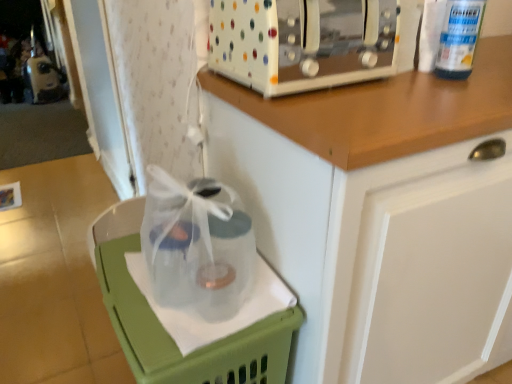
Question: Considering the relative sizes of green plastic basket at lower left and white polka dot toaster at upper center in the image provided, is green plastic basket at lower left shorter than white polka dot toaster at upper center?

Choices:
 (A) yes
 (B) no

Answer: (B)

Question: Is green plastic basket at lower left further to the viewer compared to white polka dot toaster at upper center?

Choices:
 (A) no
 (B) yes

Answer: (A)

Question: From the image's perspective, is green plastic basket at lower left over white polka dot toaster at upper center?

Choices:
 (A) yes
 (B) no

Answer: (B)

Question: Does green plastic basket at lower left have a greater height compared to white polka dot toaster at upper center?

Choices:
 (A) no
 (B) yes

Answer: (B)

Question: Can you confirm if green plastic basket at lower left is smaller than white polka dot toaster at upper center?

Choices:
 (A) no
 (B) yes

Answer: (A)

Question: Is green plastic basket at lower left looking in the opposite direction of white polka dot toaster at upper center?

Choices:
 (A) no
 (B) yes

Answer: (A)

Question: Does white polka dot toaster at upper center have a smaller size compared to white glossy cabinet at upper center?

Choices:
 (A) yes
 (B) no

Answer: (A)

Question: Would you say white polka dot toaster at upper center is outside white glossy cabinet at upper center?

Choices:
 (A) yes
 (B) no

Answer: (A)

Question: Does white polka dot toaster at upper center have a greater height compared to white glossy cabinet at upper center?

Choices:
 (A) no
 (B) yes

Answer: (A)

Question: Is white polka dot toaster at upper center oriented towards white glossy cabinet at upper center?

Choices:
 (A) yes
 (B) no

Answer: (B)

Question: From the image's perspective, is white polka dot toaster at upper center located above white glossy cabinet at upper center?

Choices:
 (A) no
 (B) yes

Answer: (B)

Question: Is white polka dot toaster at upper center at the right side of white glossy cabinet at upper center?

Choices:
 (A) no
 (B) yes

Answer: (A)

Question: From a real-world perspective, is white polka dot toaster at upper center over green plastic basket at lower left?

Choices:
 (A) yes
 (B) no

Answer: (A)